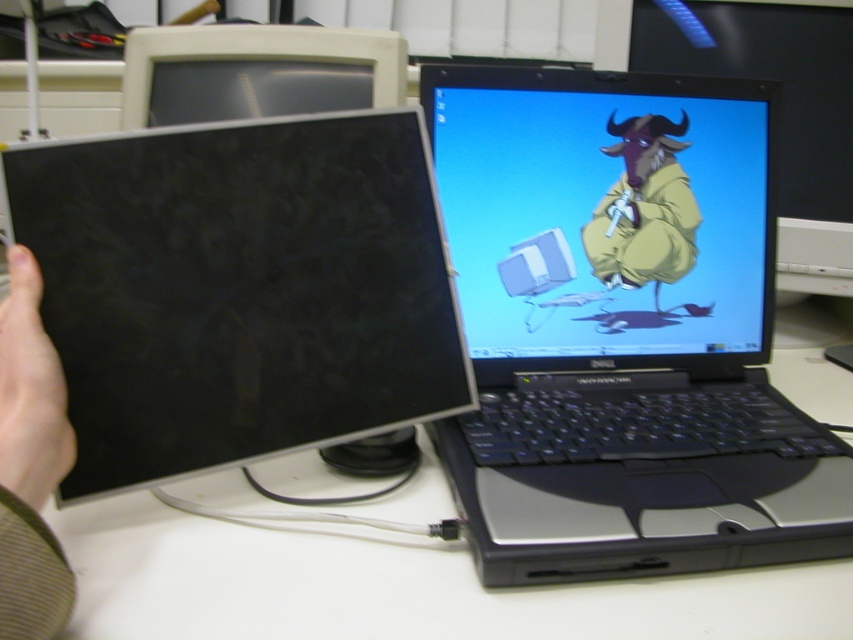
You are organizing a desk and need to place a new keyboard between the matte black monitor at center and the yellow matte jacket at center. Based on their positions, which object should the keyboard be closer to?

The keyboard should be placed closer to the yellow matte jacket at center because the matte black monitor at center is closer to the viewer, meaning the jacket is further back. To position the keyboard between them, it needs to be nearer to the jacket to maintain a logical workspace layout.

You are a photographer trying to capture a closeup of the CRT monitor and the laptop screen. You want to focus on the point at coordinates point (531, 218) and point (612, 259). Which point should you focus on first to ensure the closest object is in focus?

Point (531, 218) is closer to the camera than point (612, 259), so you should focus on point (531, 218) first to ensure the closest object is in focus.

You are organizing a small party at your home and need to place a 30 cm wide cake on the table. You see the white matte computer desk at center and the yellow matte jacket at center. Can the cake fit between them?

The white matte computer desk at center is 35.70 centimeters away from the yellow matte jacket at center. Since the cake is 30 cm wide, it can fit between them as the space is wider than the cake.